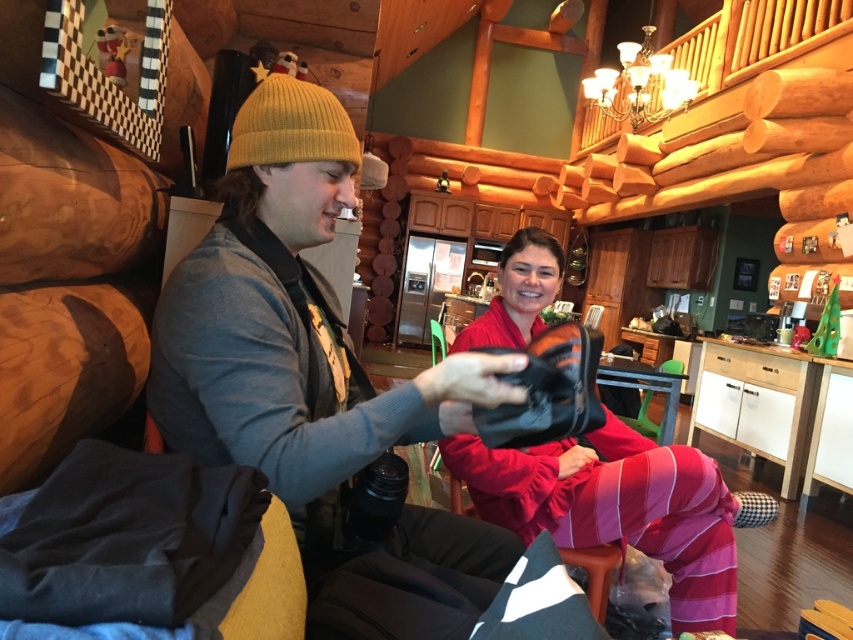
You are designing a shoe rack for the cabin and have two items to place on it. You have a matte black shoe at center and a matte black boot at center. Based on their widths, which item should you place on the narrower section of the rack?

The matte black shoe at center should be placed on the narrower section of the rack since its width is less than that of the matte black boot at center.